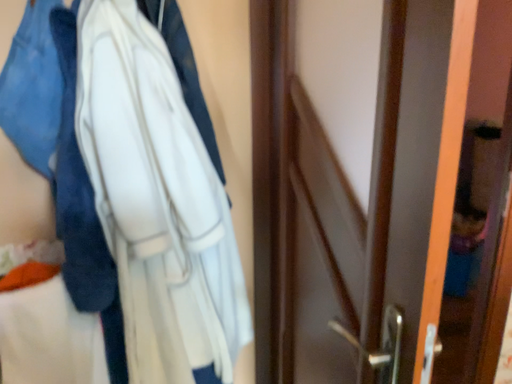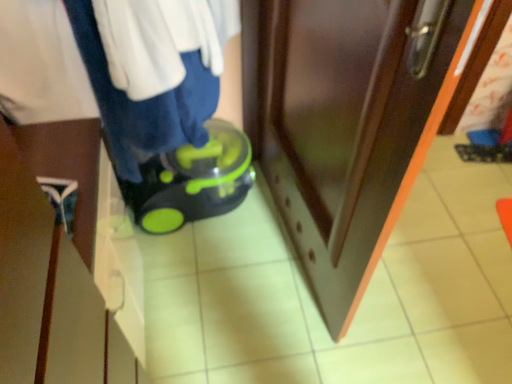
Question: How did the camera likely rotate when shooting the video?

Choices:
 (A) rotated downward
 (B) rotated upward

Answer: (A)